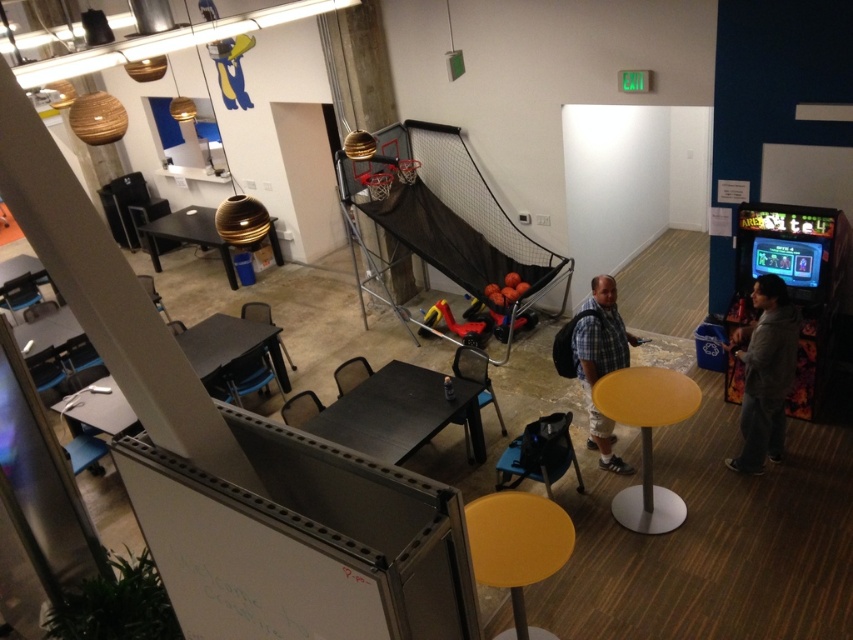
Question: Is gray hoodie at right further to the viewer compared to wooden table at center?

Choices:
 (A) no
 (B) yes

Answer: (A)

Question: Which point is closer to the camera?

Choices:
 (A) gray hoodie at right
 (B) wooden table at center
 (C) yellow matte table at center
 (D) black plastic table at lower left

Answer: (C)

Question: Which of the following is the closest to the observer?

Choices:
 (A) yellow matte table at center
 (B) black matte table at center
 (C) black plastic table at lower left
 (D) plaid shirt at center

Answer: (A)

Question: Can you confirm if yellow matte table at center is wider than wooden table at center?

Choices:
 (A) yes
 (B) no

Answer: (B)

Question: Does plaid shirt at center have a larger size compared to wooden table at center?

Choices:
 (A) no
 (B) yes

Answer: (A)

Question: Which of the following is the farthest from the observer?

Choices:
 (A) yellow matte table at center
 (B) gray hoodie at right

Answer: (B)